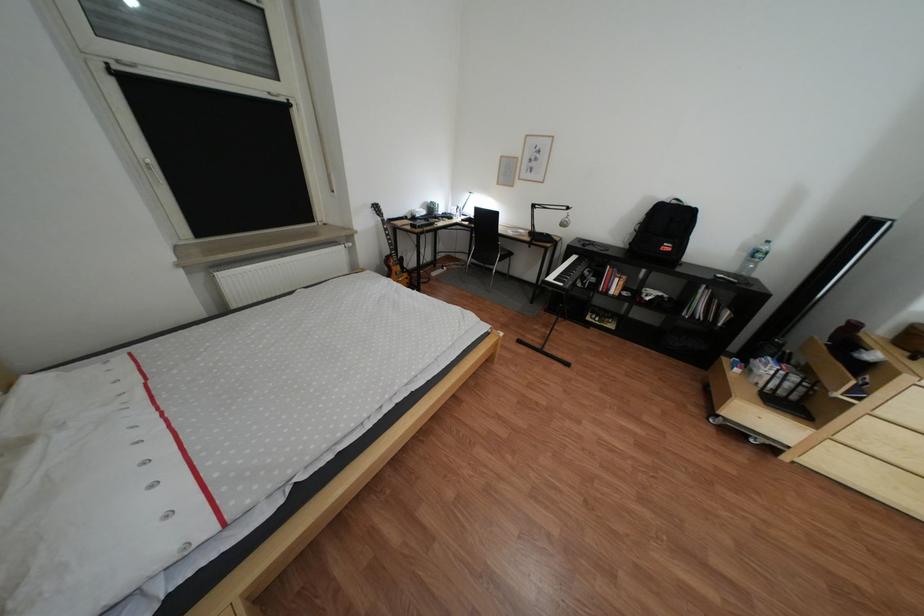
Identify the location of electric guitar. This screenshot has width=924, height=616. (392, 253).